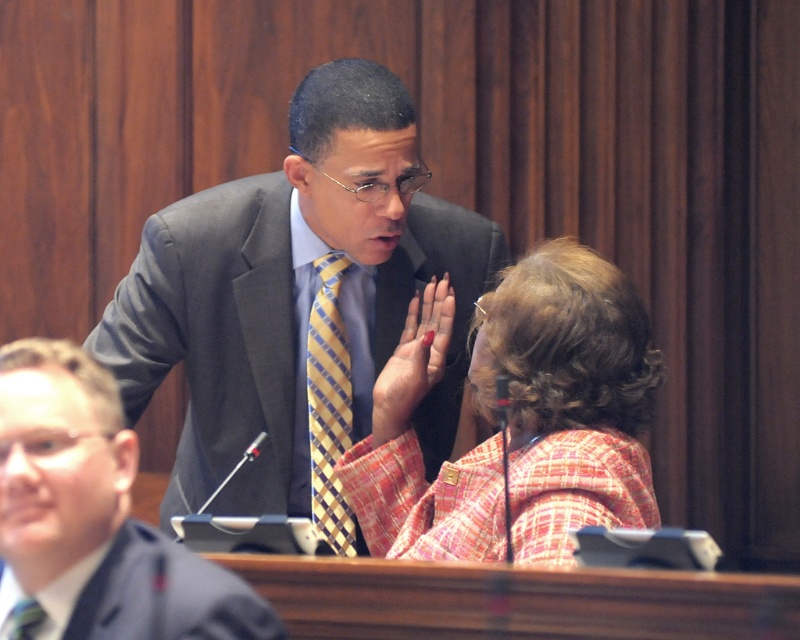
Can you confirm if plaid fabric jacket at center is shorter than yellow plaid tie at upper center?

No, plaid fabric jacket at center is not shorter than yellow plaid tie at upper center.

Which of these two, plaid fabric jacket at center or yellow plaid tie at upper center, stands taller?

With more height is plaid fabric jacket at center.

Identify the location of plaid fabric jacket at center. (568, 396).

Locate an element on the screen. This screenshot has width=800, height=640. plaid fabric jacket at center is located at coordinates (568, 396).

Can you confirm if matte gray suit at center is positioned above plaid fabric jacket at center?

Yes.

Is point (314, 460) closer to viewer compared to point (588, 355)?

No.

Where is `matte gray suit at center`? matte gray suit at center is located at coordinates (298, 301).

Identify the location of matte gray suit at center. The height and width of the screenshot is (640, 800). (298, 301).

Does yellow checkered tie at center have a greater width compared to yellow plaid tie at upper center?

Yes.

Is yellow checkered tie at center positioned at the back of yellow plaid tie at upper center?

Yes, it is.

Which is behind, point (329, 269) or point (34, 621)?

Point (329, 269)

Locate an element on the screen. yellow checkered tie at center is located at coordinates (329, 404).